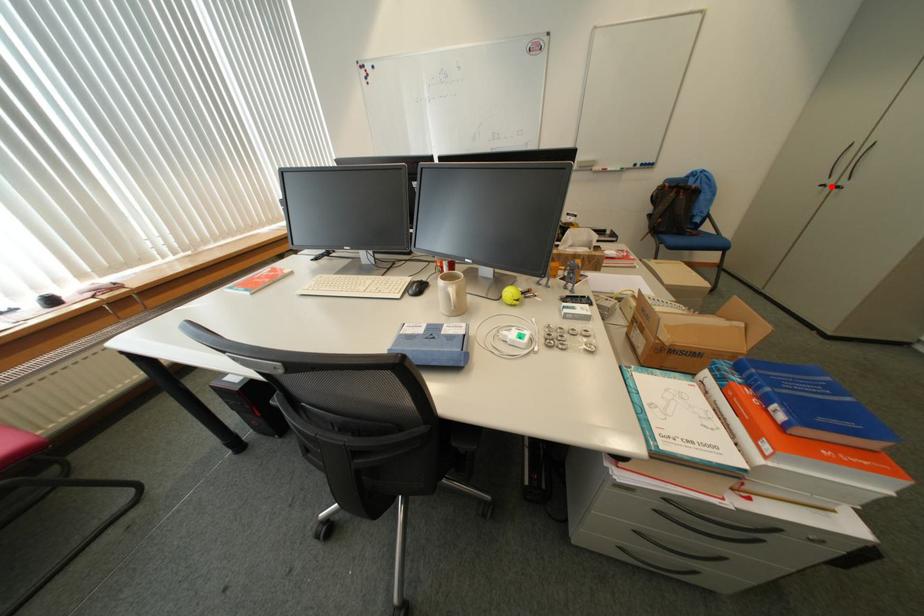
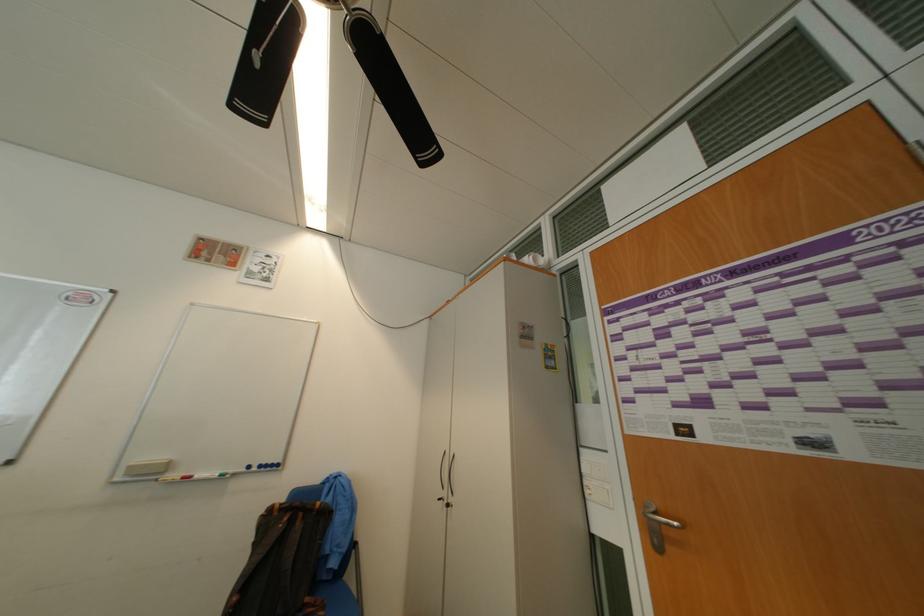
Question: I am providing you with two images of the same scene from different viewpoints. In image1, a red point is highlighted. Considering the same 3D point in image2, which of the following is correct?

Choices:
 (A) It is closer
 (B) It is farther

Answer: (A)